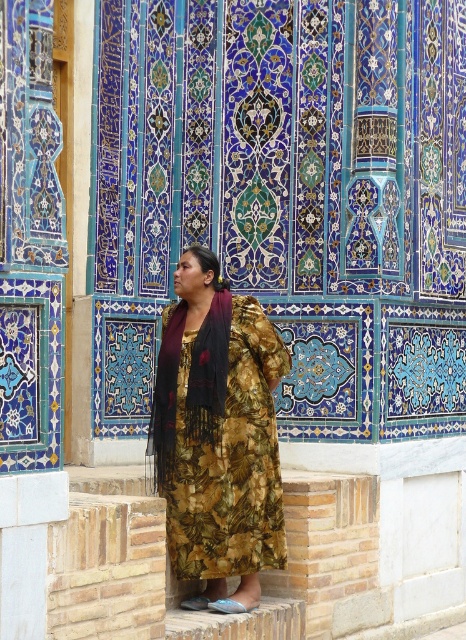
Question: Is floral print dress at center wider than black fringed scarf at center?

Choices:
 (A) yes
 (B) no

Answer: (B)

Question: Which point is farther from the camera taking this photo?

Choices:
 (A) (157, 440)
 (B) (212, 580)

Answer: (A)

Question: Does floral print dress at center appear under black fringed scarf at center?

Choices:
 (A) yes
 (B) no

Answer: (A)

Question: Is floral print dress at center in front of black fringed scarf at center?

Choices:
 (A) yes
 (B) no

Answer: (B)